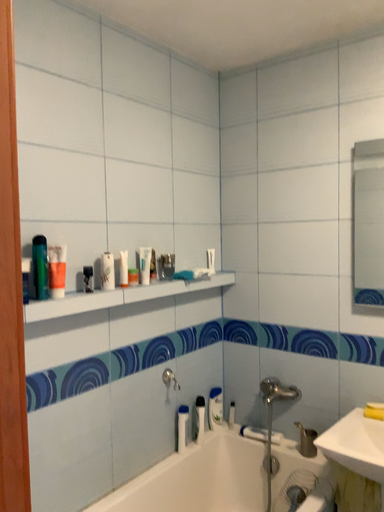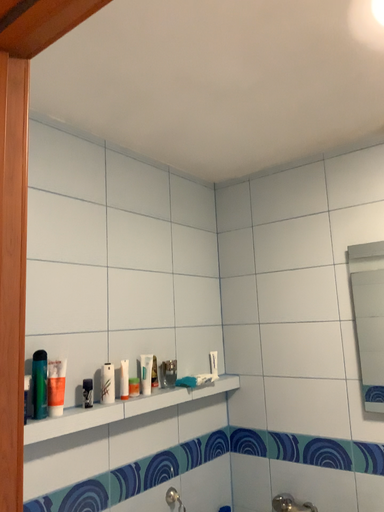
Question: Which way did the camera rotate in the video?

Choices:
 (A) rotated upward
 (B) rotated downward

Answer: (A)